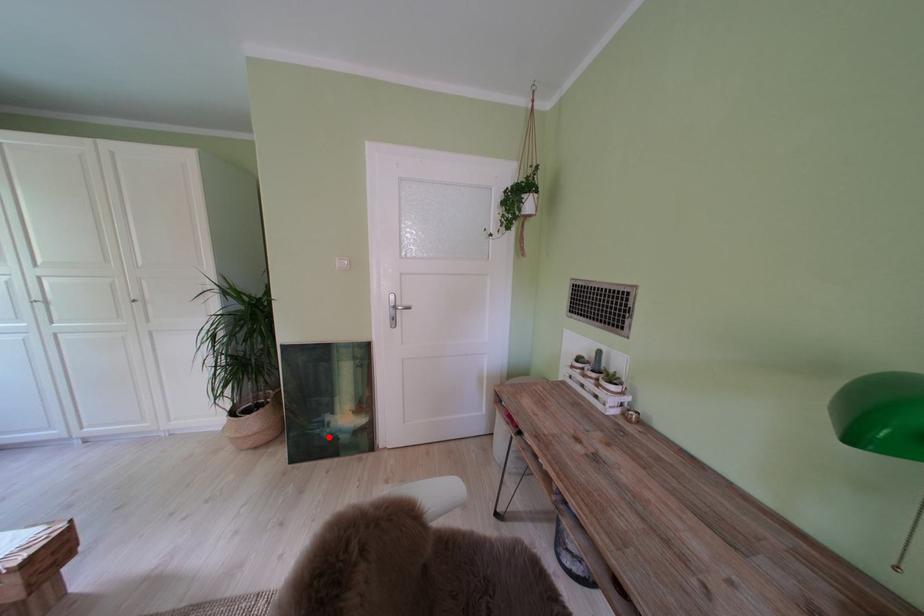
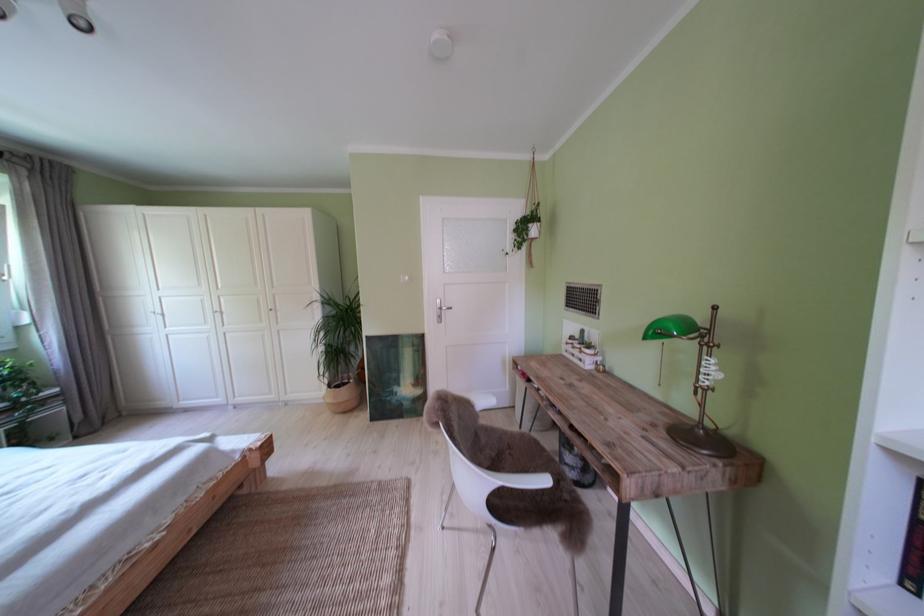
Find the pixel in the second image that matches the highlighted location in the first image.

(399, 403)